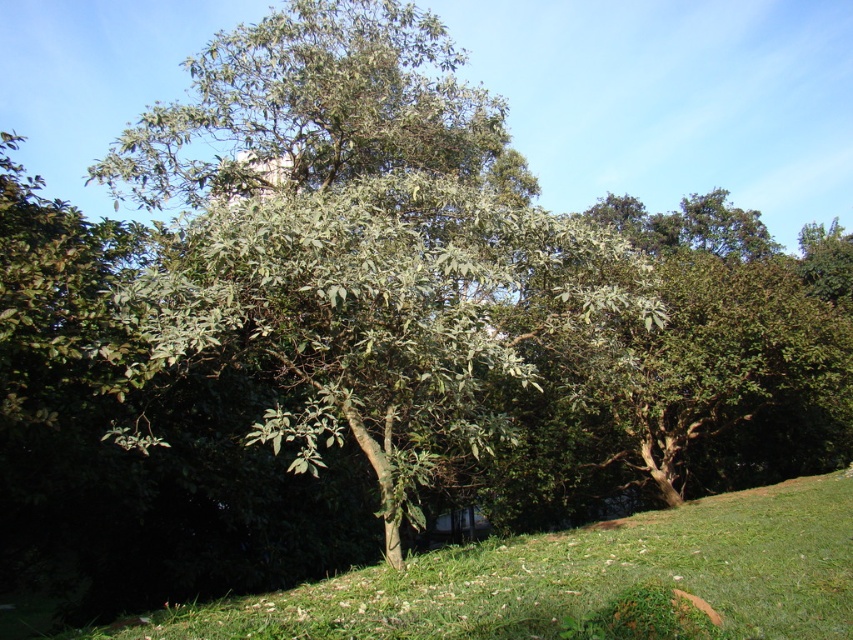
Question: Is green leafy tree at center to the right of green grassy at lower center from the viewer's perspective?

Choices:
 (A) no
 (B) yes

Answer: (A)

Question: Can you confirm if green leafy tree at center is bigger than green grassy at lower center?

Choices:
 (A) yes
 (B) no

Answer: (A)

Question: Is green leafy tree at center thinner than green grassy at lower center?

Choices:
 (A) yes
 (B) no

Answer: (B)